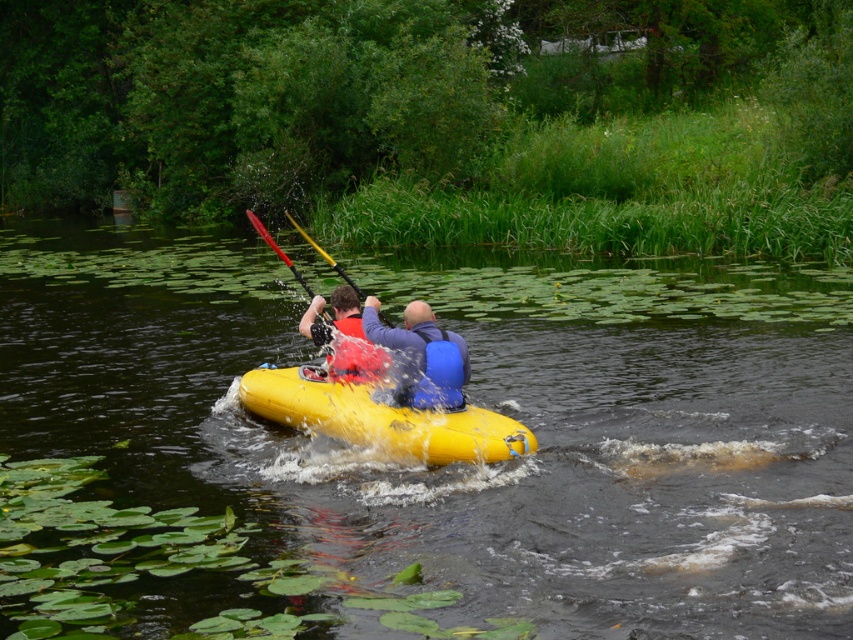
Question: Which object is positioned closest to the red plastic paddle at center?

Choices:
 (A) matte black life vest at center
 (B) yellow rubber canoe at center
 (C) matte blue life jacket at center

Answer: (C)

Question: Can you confirm if matte blue life jacket at center is positioned to the left of red plastic paddle at center?

Choices:
 (A) yes
 (B) no

Answer: (B)

Question: Which object is positioned farthest from the matte blue life jacket at center?

Choices:
 (A) red plastic paddle at center
 (B) blue padded life vest at center

Answer: (A)

Question: Can you confirm if matte black life vest at center is positioned to the left of red plastic paddle at center?

Choices:
 (A) yes
 (B) no

Answer: (B)

Question: Which is farther from the red plastic paddle at center?

Choices:
 (A) yellow plastic paddle at center
 (B) blue padded life vest at center
 (C) yellow rubber boat at center

Answer: (C)

Question: Where is blue padded life vest at center located in relation to red plastic paddle at center in the image?

Choices:
 (A) right
 (B) left

Answer: (A)